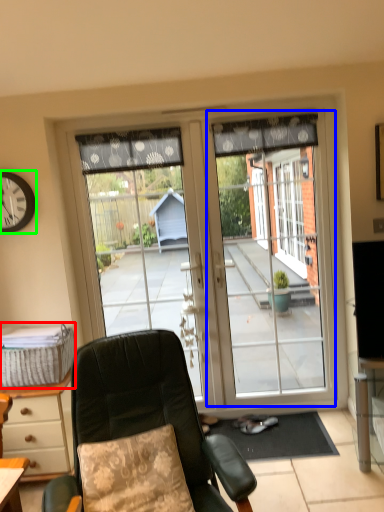
Question: Based on their relative distances, which object is farther from picnic basket (highlighted by a red box)? Choose from screen door (highlighted by a blue box) and clock (highlighted by a green box).

Choices:
 (A) screen door
 (B) clock

Answer: (A)